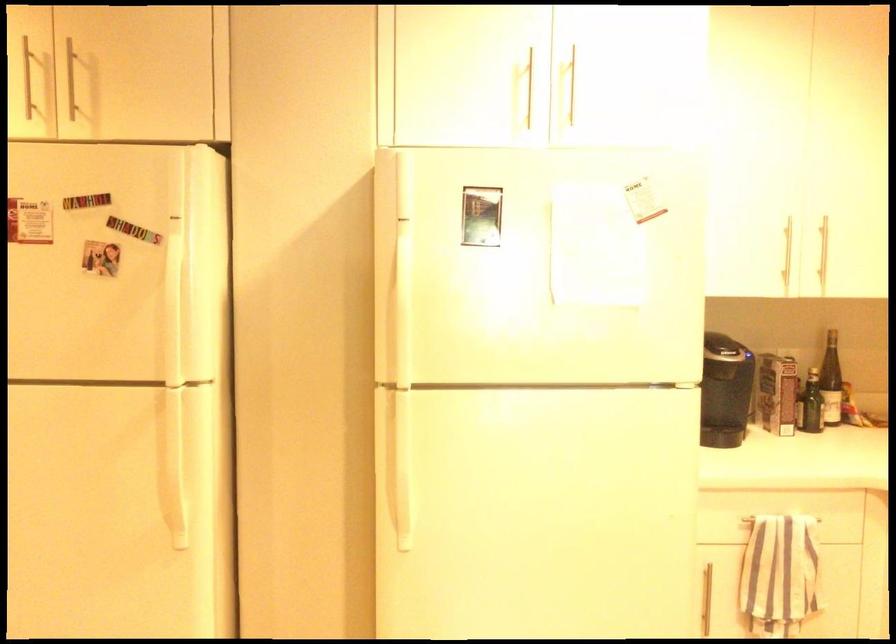
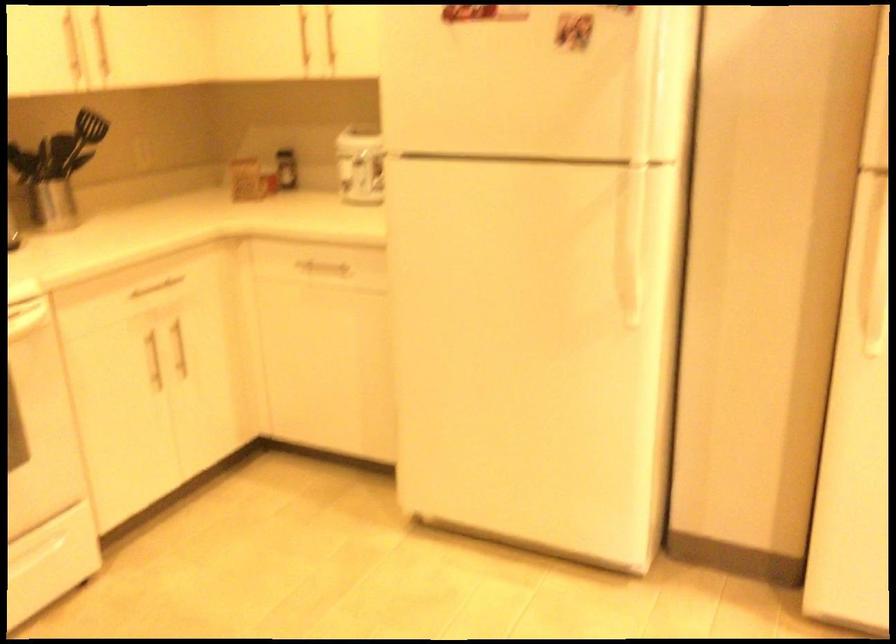
The point at (x=179, y=498) is marked in the first image. Where is the corresponding point in the second image?

(634, 277)